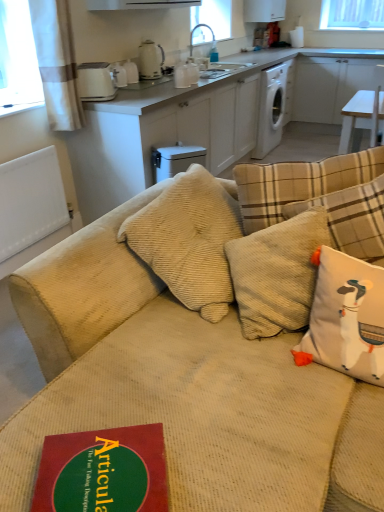
Question: Based on their positions, is white plastic dishwasher at center located to the left or right of white textured curtain at upper left?

Choices:
 (A) left
 (B) right

Answer: (B)

Question: From a real-world perspective, is white plastic dishwasher at center positioned above or below white textured curtain at upper left?

Choices:
 (A) below
 (B) above

Answer: (A)

Question: Which is nearer to the white ceramic kettle at upper center, positioned as the third appliance in right-to-left order?

Choices:
 (A) white textured curtain at upper left
 (B) white corduroy pillow at right
 (C) beige corduroy couch at center
 (D) white plastic toaster at upper left, arranged as the 4th appliance when viewed from the right
 (E) white plastic dishwasher at center

Answer: (D)

Question: Considering the real-world distances, which object is farthest from the white plastic dishwasher at center?

Choices:
 (A) white glossy kettle at upper center, the 1th appliance positioned from the right
 (B) white glossy electric kettle at upper center, acting as the 3th appliance starting from the left
 (C) white ceramic kettle at upper center, the second appliance from the left
 (D) beige corduroy couch at center
 (E) white glossy exhaust hood at upper center

Answer: (D)